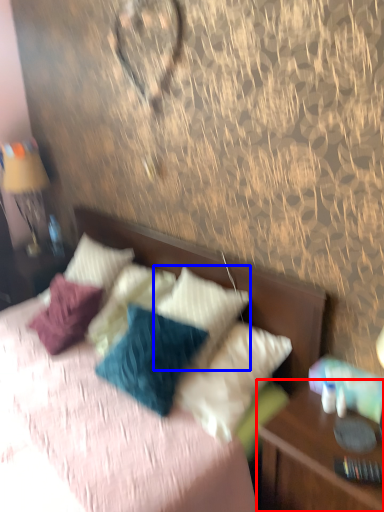
Question: Which object appears farthest to the camera in this image, nightstand (highlighted by a red box) or pillow (highlighted by a blue box)?

Choices:
 (A) nightstand
 (B) pillow

Answer: (B)